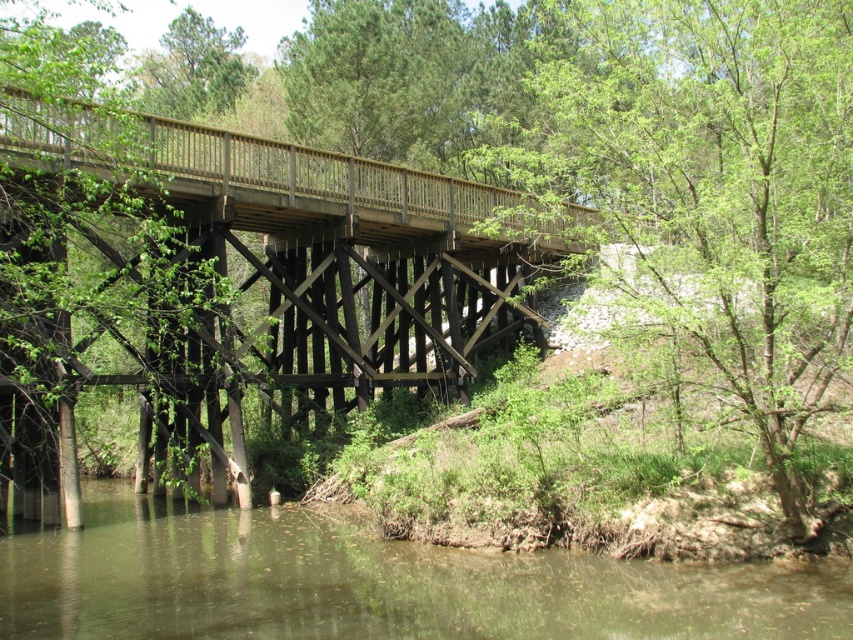
Question: Does green leafy tree at center have a lesser width compared to wooden bridge at center?

Choices:
 (A) no
 (B) yes

Answer: (B)

Question: Which point appears closest to the camera in this image?

Choices:
 (A) (637, 572)
 (B) (198, 172)

Answer: (A)

Question: Which of these objects is positioned closest to the brown murky water at lower center?

Choices:
 (A) green leafy tree at center
 (B) wooden bridge at center

Answer: (B)

Question: Does green leafy tree at center appear over brown murky water at lower center?

Choices:
 (A) no
 (B) yes

Answer: (B)

Question: Is wooden bridge at center positioned behind brown murky water at lower center?

Choices:
 (A) yes
 (B) no

Answer: (A)

Question: Which object is the closest to the brown murky water at lower center?

Choices:
 (A) green leafy tree at center
 (B) wooden bridge at center

Answer: (B)